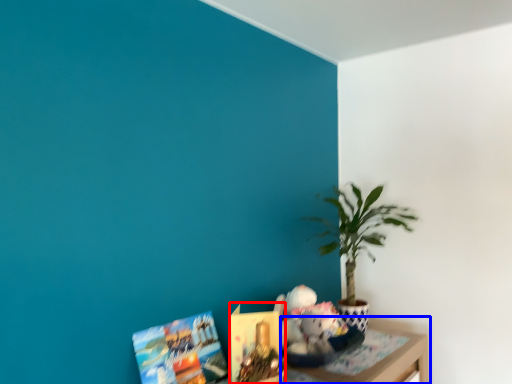
Question: Which object is further to the camera taking this photo, book (highlighted by a red box) or table (highlighted by a blue box)?

Choices:
 (A) book
 (B) table

Answer: (B)